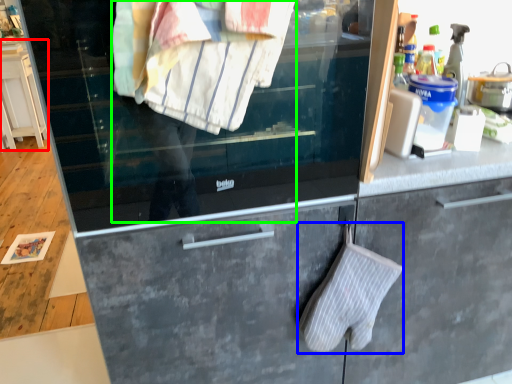
Question: Estimate the real-world distances between objects in this image. Which object is closer to dresser (highlighted by a red box), bath towel (highlighted by a blue box) or person (highlighted by a green box)?

Choices:
 (A) bath towel
 (B) person

Answer: (B)